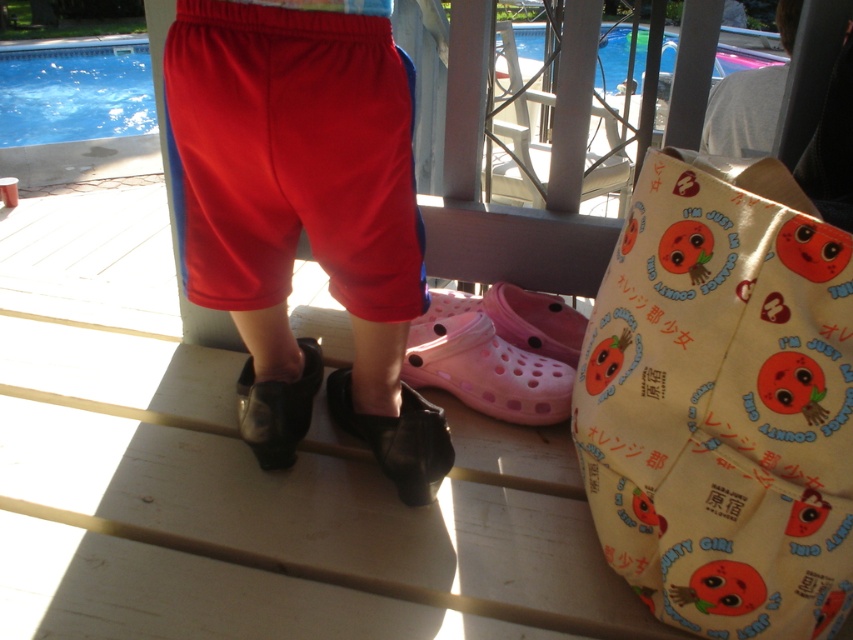
You are standing on the wooden deck and want to walk to the blue glossy water at upper left without stepping on the black leather shoe at lower center. Is there enough space to walk around it?

The blue glossy water at upper left might be wider than the black leather shoe at lower center, so there could be enough space to walk around it without stepping on the shoe.